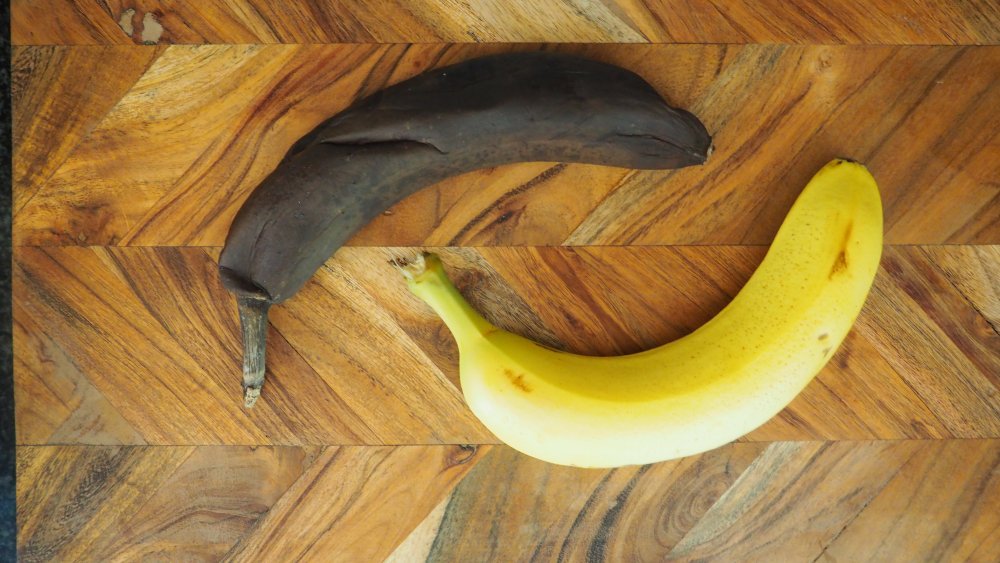
Find the location of a particular element. This screenshot has height=563, width=1000. slats is located at coordinates (101, 388).